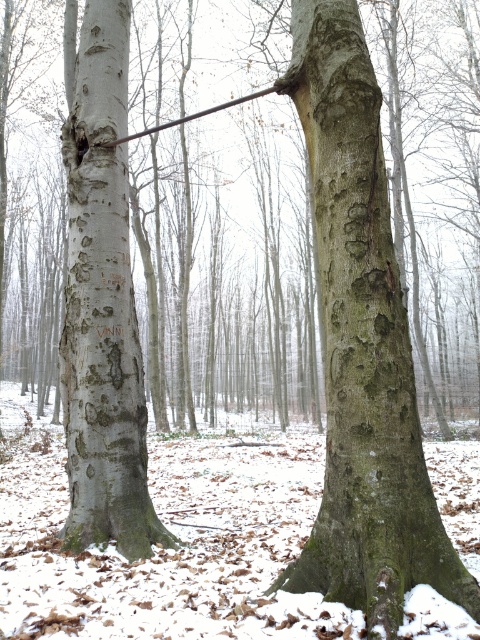
Question: Which point is farther to the camera?

Choices:
 (A) (434, 524)
 (B) (99, 406)

Answer: (B)

Question: Observing the image, what is the correct spatial positioning of green rough bark tree trunk at center in reference to smooth gray bark at left?

Choices:
 (A) above
 (B) below

Answer: (B)

Question: Where is green rough bark tree trunk at center located in relation to smooth gray bark at left in the image?

Choices:
 (A) below
 (B) above

Answer: (A)

Question: Does green rough bark tree trunk at center appear on the left side of smooth gray bark at left?

Choices:
 (A) no
 (B) yes

Answer: (A)